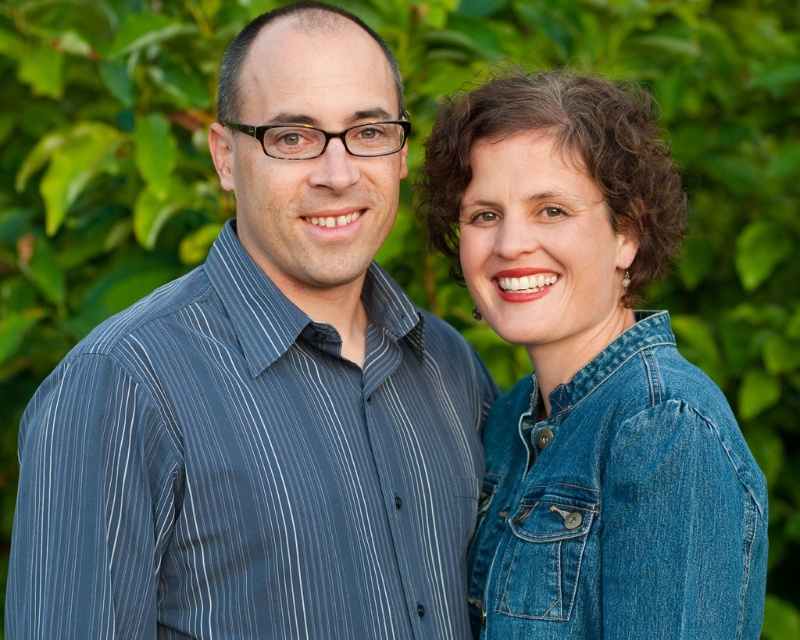
Question: Which of these objects is positioned closest to the denim jacket at lower right?

Choices:
 (A) denim jacket at right
 (B) blue striped shirt at left

Answer: (A)

Question: Considering the relative positions of denim jacket at right and denim jacket at lower right in the image provided, where is denim jacket at right located with respect to denim jacket at lower right?

Choices:
 (A) right
 (B) left

Answer: (B)

Question: Which object appears closest to the camera in this image?

Choices:
 (A) blue striped shirt at left
 (B) denim jacket at right
 (C) denim jacket at lower right

Answer: (A)

Question: Does denim jacket at right lie behind denim jacket at lower right?

Choices:
 (A) no
 (B) yes

Answer: (B)

Question: Can you confirm if blue striped shirt at left is wider than denim jacket at right?

Choices:
 (A) no
 (B) yes

Answer: (B)

Question: Estimate the real-world distances between objects in this image. Which object is closer to the denim jacket at right?

Choices:
 (A) blue striped shirt at left
 (B) denim jacket at lower right

Answer: (B)